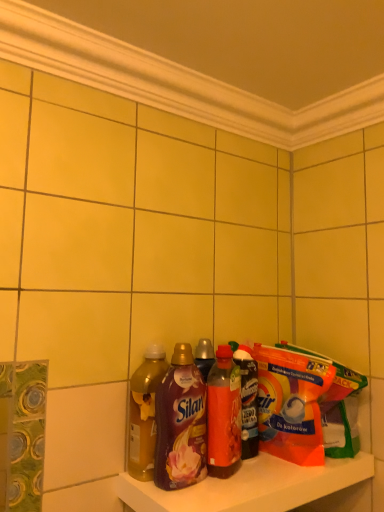
Consider the image. Measure the distance between point (328, 479) and camera.

Point (328, 479) is 38.74 inches away from camera.

Find the location of a particular element. The image size is (384, 512). translucent plastic bottles at lower center is located at coordinates (x=251, y=486).

Image resolution: width=384 pixels, height=512 pixels. Find the location of `translucent amber liquid at shelf center, which is the fourth bottle from right to left`. translucent amber liquid at shelf center, which is the fourth bottle from right to left is located at coordinates (144, 412).

From the picture: How much space does translucent amber liquid at shelf center, which is the fourth bottle from right to left, occupy vertically?

The height of translucent amber liquid at shelf center, which is the fourth bottle from right to left, is 10.90 inches.

This screenshot has height=512, width=384. What do you see at coordinates (248, 399) in the screenshot? I see `translucent plastic bottle at center, positioned as the 1th bottle in right-to-left order` at bounding box center [248, 399].

Image resolution: width=384 pixels, height=512 pixels. Identify the location of translucent plastic bottle at center, the second bottle viewed from the right. (224, 415).

Is translucent plastic bottles at lower center surrounding translucent plastic bottle at center, the second bottle viewed from the right?

No, translucent plastic bottle at center, the second bottle viewed from the right, is not surrounded by translucent plastic bottles at lower center.

From a real-world perspective, between translucent plastic bottles at lower center and translucent plastic bottle at center, the second bottle viewed from the right, who is vertically lower?

translucent plastic bottles at lower center is physically lower.

Based on their positions, is translucent plastic bottles at lower center located to the left or right of translucent plastic bottle at center, which ranks as the 3th bottle in left-to-right order?

translucent plastic bottles at lower center is positioned on translucent plastic bottle at center, which ranks as the 3th bottle in left-to-right order,'s right side.

From the image's perspective, between translucent plastic bottles at lower center and translucent plastic bottle at center, which ranks as the 3th bottle in left-to-right order, which one is located above?

translucent plastic bottle at center, which ranks as the 3th bottle in left-to-right order, is shown above in the image.

In the scene shown: From the image's perspective, is translucent plastic bottles at lower center below translucent plastic bottle at center, positioned as the 1th bottle in right-to-left order?

Yes, from the image's perspective, translucent plastic bottles at lower center is below translucent plastic bottle at center, positioned as the 1th bottle in right-to-left order.

Identify the location of shelf that is under the translucent plastic bottle at center, positioned as the 1th bottle in right-to-left order (from a real-world perspective). The height and width of the screenshot is (512, 384). (251, 486).

Is translucent plastic bottles at lower center directly adjacent to translucent plastic bottle at center, positioned as the 1th bottle in right-to-left order?

No, translucent plastic bottles at lower center is not with translucent plastic bottle at center, positioned as the 1th bottle in right-to-left order.

Could you measure the distance between translucent plastic bottles at lower center and translucent plastic bottle at center, positioned as the 1th bottle in right-to-left order?

translucent plastic bottles at lower center and translucent plastic bottle at center, positioned as the 1th bottle in right-to-left order, are 6.28 inches apart from each other.

From the image's perspective, which one is positioned higher, translucent plastic bottle at center, the second bottle viewed from the right, or matte plastic bottle at center, placed as the 3th bottle when sorted from right to left?

matte plastic bottle at center, placed as the 3th bottle when sorted from right to left, appears higher in the image.

Considering the relative sizes of translucent plastic bottle at center, which ranks as the 3th bottle in left-to-right order, and matte plastic bottle at center, placed as the 3th bottle when sorted from right to left, in the image provided, is translucent plastic bottle at center, which ranks as the 3th bottle in left-to-right order, thinner than matte plastic bottle at center, placed as the 3th bottle when sorted from right to left,?

No.

From the picture: Is translucent plastic bottle at center, the second bottle viewed from the right, turned away from matte plastic bottle at center, the 2th bottle from the left?

translucent plastic bottle at center, the second bottle viewed from the right, is not turned away from matte plastic bottle at center, the 2th bottle from the left.

From a real-world perspective, which is physically below, translucent plastic bottle at center, which ranks as the 3th bottle in left-to-right order, or matte plastic bottle at center, the 2th bottle from the left?

translucent plastic bottle at center, which ranks as the 3th bottle in left-to-right order, from a real-world perspective.

From a real-world perspective, is translucent plastic bottle at center, placed as the 4th bottle when sorted from left to right, over matte plastic bottle at center, placed as the 3th bottle when sorted from right to left?

No, from a real-world perspective, translucent plastic bottle at center, placed as the 4th bottle when sorted from left to right, is not on top of matte plastic bottle at center, placed as the 3th bottle when sorted from right to left.

Which is closer, [249,366] or [188,373]?

Positioned in front is point [188,373].

Is translucent plastic bottle at center, placed as the 4th bottle when sorted from left to right, bigger than matte plastic bottle at center, placed as the 3th bottle when sorted from right to left?

No.

Consider the image. Relative to translucent plastic bottle at center, positioned as the 1th bottle in right-to-left order, is translucent amber liquid at shelf center, placed as the first bottle when sorted from left to right, in front or behind?

Visually, translucent amber liquid at shelf center, placed as the first bottle when sorted from left to right, is located in front of translucent plastic bottle at center, positioned as the 1th bottle in right-to-left order.

Which object is positioned more to the right, translucent amber liquid at shelf center, which is the fourth bottle from right to left, or translucent plastic bottle at center, positioned as the 1th bottle in right-to-left order?

translucent plastic bottle at center, positioned as the 1th bottle in right-to-left order.

Does translucent amber liquid at shelf center, placed as the first bottle when sorted from left to right, touch translucent plastic bottle at center, placed as the 4th bottle when sorted from left to right?

No, translucent amber liquid at shelf center, placed as the first bottle when sorted from left to right, is not with translucent plastic bottle at center, placed as the 4th bottle when sorted from left to right.

From the image's perspective, is translucent amber liquid at shelf center, placed as the first bottle when sorted from left to right, positioned above or below orange plastic bag at shelf right?

translucent amber liquid at shelf center, placed as the first bottle when sorted from left to right, is above orange plastic bag at shelf right.

From a real-world perspective, who is located higher, translucent amber liquid at shelf center, placed as the first bottle when sorted from left to right, or orange plastic bag at shelf right?

translucent amber liquid at shelf center, placed as the first bottle when sorted from left to right.

Can you confirm if translucent amber liquid at shelf center, placed as the first bottle when sorted from left to right, is bigger than orange plastic bag at shelf right?

Actually, translucent amber liquid at shelf center, placed as the first bottle when sorted from left to right, might be smaller than orange plastic bag at shelf right.

Is orange plastic bag at shelf right completely or partially inside matte plastic bottle at center, the 2th bottle from the left?

Definitely not — orange plastic bag at shelf right is not inside matte plastic bottle at center, the 2th bottle from the left.

From a real-world perspective, between matte plastic bottle at center, placed as the 3th bottle when sorted from right to left, and orange plastic bag at shelf right, who is vertically lower?

orange plastic bag at shelf right.

Is matte plastic bottle at center, the 2th bottle from the left, aimed at orange plastic bag at shelf right?

No.

Considering the sizes of matte plastic bottle at center, the 2th bottle from the left, and orange plastic bag at shelf right in the image, is matte plastic bottle at center, the 2th bottle from the left, wider or thinner than orange plastic bag at shelf right?

Clearly, matte plastic bottle at center, the 2th bottle from the left, has less width compared to orange plastic bag at shelf right.

The image size is (384, 512). What are the coordinates of `the 3rd bottle positioned above the translucent plastic bottles at lower center (from a real-world perspective)` in the screenshot? It's located at (224, 415).

Identify the location of shelf on the right of translucent plastic bottle at center, positioned as the 1th bottle in right-to-left order. (251, 486).

Consider the image. From the image, which object appears to be nearer to translucent plastic bottles at lower center, translucent amber liquid at shelf center, placed as the first bottle when sorted from left to right, or orange plastic bag at shelf right?

orange plastic bag at shelf right is closer to translucent plastic bottles at lower center.

Looking at the image, which one is located further to orange plastic bag at shelf right, translucent amber liquid at shelf center, which is the fourth bottle from right to left, or matte plastic bottle at center, placed as the 3th bottle when sorted from right to left?

translucent amber liquid at shelf center, which is the fourth bottle from right to left, lies further to orange plastic bag at shelf right than the other object.

Which object lies further to the anchor point translucent amber liquid at shelf center, placed as the first bottle when sorted from left to right, orange plastic bag at shelf right or translucent plastic bottle at center, the second bottle viewed from the right?

The object further to translucent amber liquid at shelf center, placed as the first bottle when sorted from left to right, is orange plastic bag at shelf right.

Considering their positions, is translucent plastic bottles at lower center positioned further to matte plastic bottle at center, the 2th bottle from the left, than translucent amber liquid at shelf center, which is the fourth bottle from right to left?

translucent plastic bottles at lower center is further to matte plastic bottle at center, the 2th bottle from the left.

From the image, which object appears to be nearer to matte plastic bottle at center, placed as the 3th bottle when sorted from right to left, translucent plastic bottle at center, placed as the 4th bottle when sorted from left to right, or translucent plastic bottles at lower center?

Among the two, translucent plastic bottles at lower center is located nearer to matte plastic bottle at center, placed as the 3th bottle when sorted from right to left.

When comparing their distances from translucent amber liquid at shelf center, which is the fourth bottle from right to left, does matte plastic bottle at center, placed as the 3th bottle when sorted from right to left, or translucent plastic bottle at center, which ranks as the 3th bottle in left-to-right order, seem closer?

matte plastic bottle at center, placed as the 3th bottle when sorted from right to left, lies closer to translucent amber liquid at shelf center, which is the fourth bottle from right to left, than the other object.

Looking at the image, which one is located further to translucent amber liquid at shelf center, which is the fourth bottle from right to left, translucent plastic bottle at center, the second bottle viewed from the right, or orange plastic bag at shelf right?

Among the two, orange plastic bag at shelf right is located further to translucent amber liquid at shelf center, which is the fourth bottle from right to left.

From the image, which object appears to be nearer to translucent plastic bottle at center, placed as the 4th bottle when sorted from left to right, translucent plastic bottles at lower center or translucent plastic bottle at center, which ranks as the 3th bottle in left-to-right order?

The object closer to translucent plastic bottle at center, placed as the 4th bottle when sorted from left to right, is translucent plastic bottle at center, which ranks as the 3th bottle in left-to-right order.

I want to click on shelf situated between translucent amber liquid at shelf center, which is the fourth bottle from right to left, and orange plastic bag at shelf right from left to right, so click(251, 486).

At what (x,y) coordinates should I click in order to perform the action: click on cereal positioned between translucent plastic bottles at lower center and translucent plastic bottle at center, placed as the 4th bottle when sorted from left to right, from near to far. Please return your answer as a coordinate pair (x, y). This screenshot has width=384, height=512. Looking at the image, I should click on (291, 404).

In order to click on bottle between translucent plastic bottle at center, the second bottle viewed from the right, and orange plastic bag at shelf right in this screenshot , I will do pyautogui.click(x=248, y=399).

You are a GUI agent. You are given a task and a screenshot of the screen. Output one action in this format:
    pyautogui.click(x=<x>, y=<y>)
    Task: Click on the bottle between translucent amber liquid at shelf center, placed as the first bottle when sorted from left to right, and translucent plastic bottle at center, which ranks as the 3th bottle in left-to-right order
    
    Given the screenshot: What is the action you would take?
    181,423